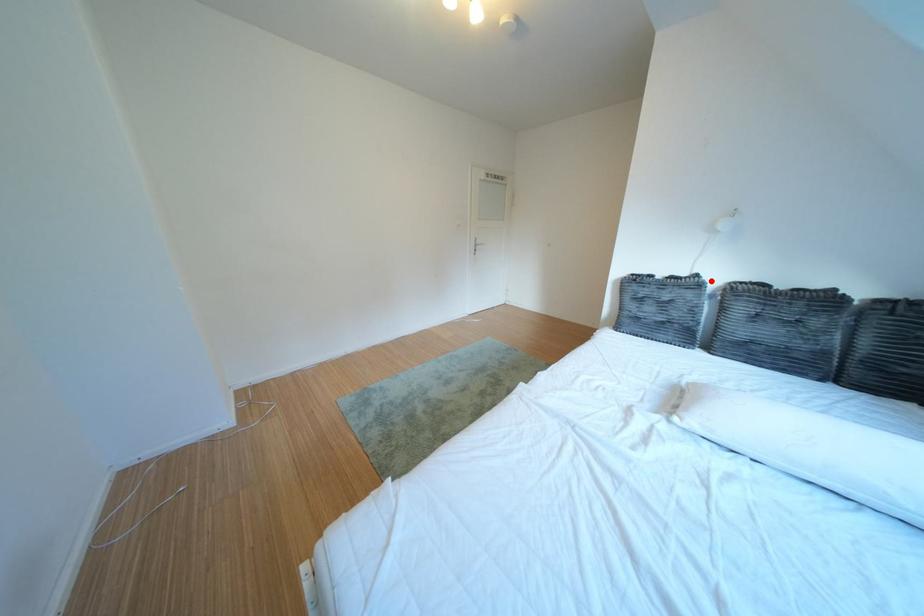
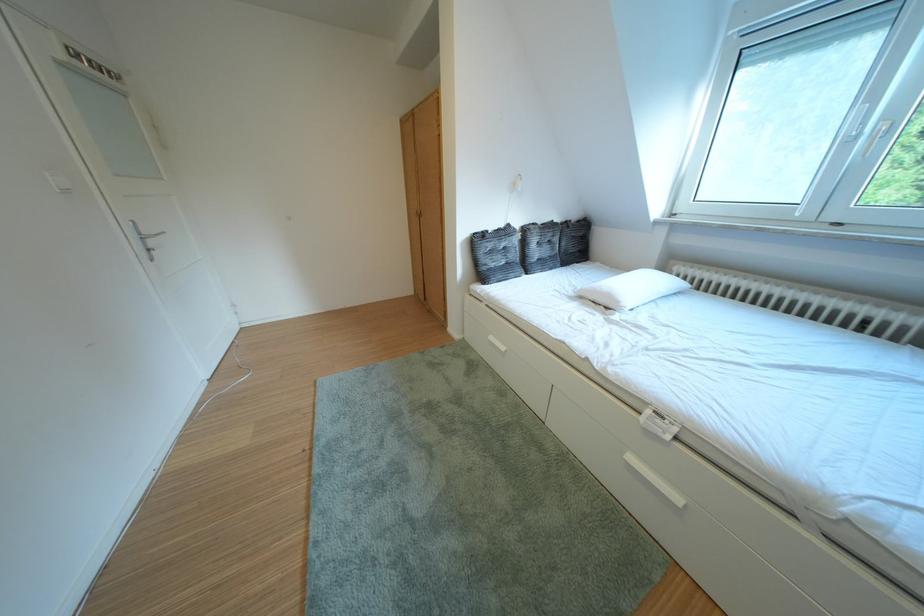
Find the pixel in the second image that matches the highlighted location in the first image.

(523, 230)